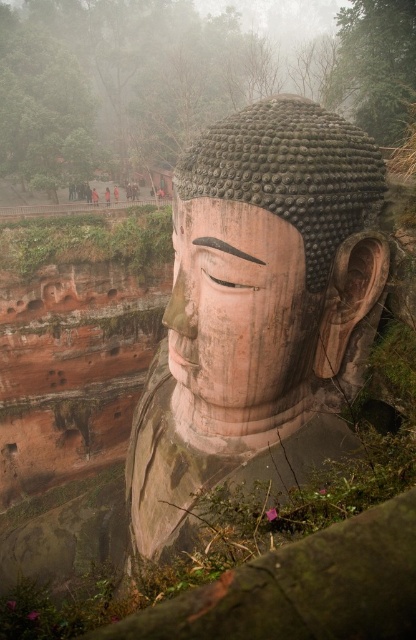
You are a sculptor working on a statue. You have two parts to attach to the cliff face, the smooth stone head at center and the smooth stone face at center. The cliff has a gap of 20 inches between two anchor points. Can both parts be attached to the cliff without overlapping?

The distance between the smooth stone head at center and smooth stone face at center is 20.29 inches. Since the cliff has a gap of 20 inches between anchor points, the two parts cannot be attached without overlapping as the required space is slightly larger than available.

Looking at the statue in the scene, which part of it is taller between the smooth stone head at center and the smooth stone face at center?

The smooth stone head at center is much taller than the smooth stone face at center.

You are an art student analyzing the statue. You notice two parts of the statue labeled as the smooth stone head at center and the smooth stone face at center. Which part is positioned closer to you?

The smooth stone head at center is closer to the viewer than the smooth stone face at center.